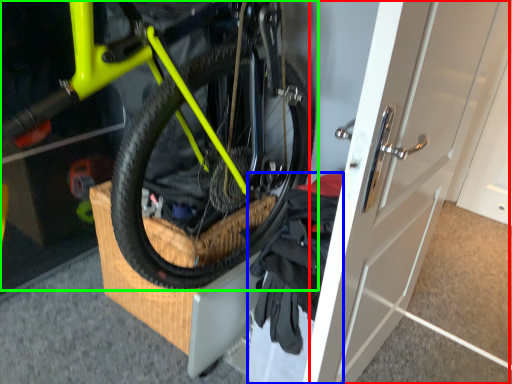
Question: Considering the real-world distances, which object is farthest from door (highlighted by a red box)? clothing (highlighted by a blue box) or bicycle (highlighted by a green box)?

Choices:
 (A) clothing
 (B) bicycle

Answer: (B)